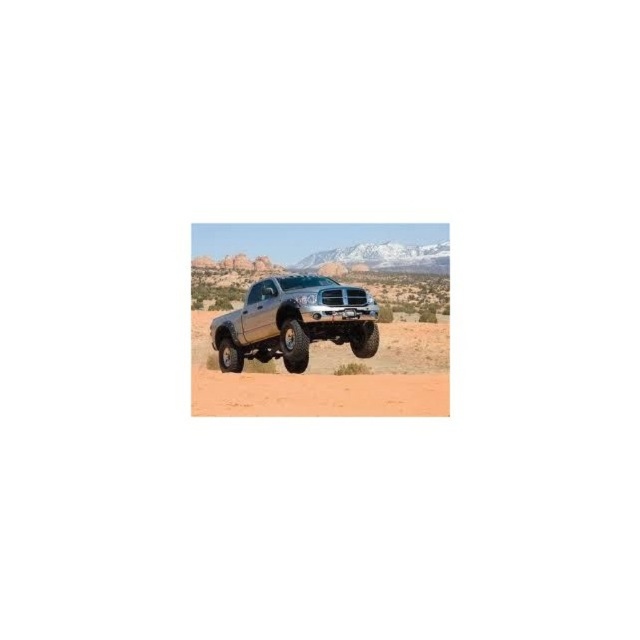
Question: Can you confirm if sandy brown dirt at center is smaller than silver metallic truck at center?

Choices:
 (A) no
 (B) yes

Answer: (A)

Question: Which object appears closest to the camera in this image?

Choices:
 (A) silver metallic truck at center
 (B) sandy brown dirt at center

Answer: (B)

Question: Which object appears closest to the camera in this image?

Choices:
 (A) sandy brown dirt at center
 (B) silver metallic truck at center

Answer: (A)

Question: Does sandy brown dirt at center have a larger size compared to silver metallic truck at center?

Choices:
 (A) no
 (B) yes

Answer: (B)

Question: Is sandy brown dirt at center to the right of silver metallic truck at center from the viewer's perspective?

Choices:
 (A) no
 (B) yes

Answer: (B)

Question: Which point appears farthest from the camera in this image?

Choices:
 (A) (307, 410)
 (B) (355, 305)

Answer: (B)